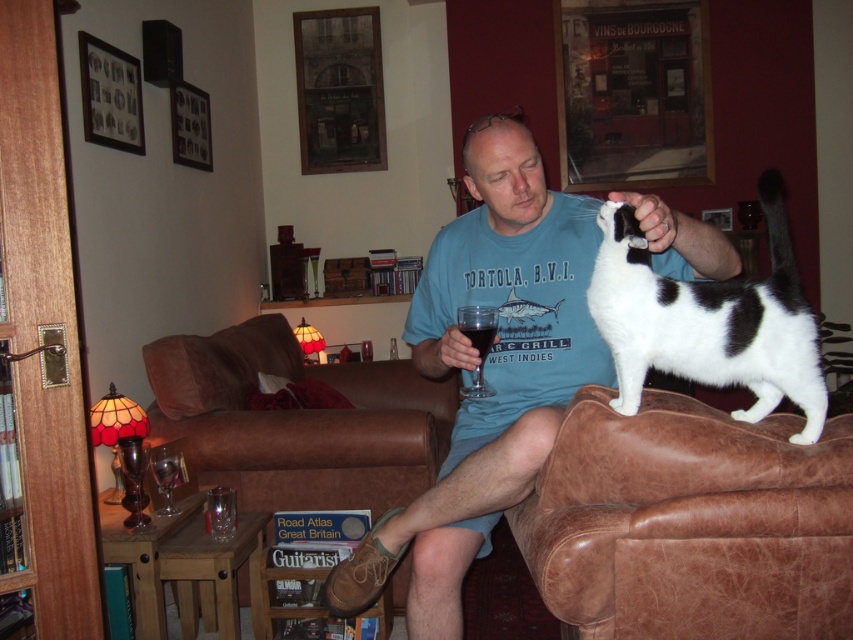
Question: Among these points, which one is nearest to the camera?

Choices:
 (A) (425, 376)
 (B) (486, 323)

Answer: (B)

Question: Estimate the real-world distances between objects in this image. Which object is farther from the brown leather couch at center?

Choices:
 (A) blue cotton shirt at center
 (B) black and white fur at upper right

Answer: (B)

Question: Can you confirm if transparent glass at right is smaller than clear glass at center?

Choices:
 (A) no
 (B) yes

Answer: (A)

Question: Is blue cotton shirt at center above black and white fur at upper right?

Choices:
 (A) yes
 (B) no

Answer: (B)

Question: Which object is the farthest from the black and white fur at upper right?

Choices:
 (A) clear glass at center
 (B) blue cotton shirt at center
 (C) brown leather couch at center

Answer: (C)

Question: Does blue cotton shirt at center appear over black and white fur at upper right?

Choices:
 (A) yes
 (B) no

Answer: (B)